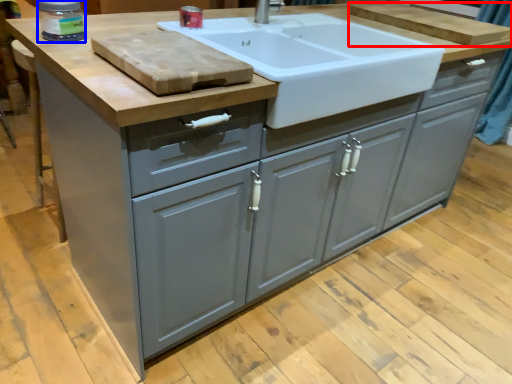
Question: Which object is closer to the camera taking this photo, cutting board (highlighted by a red box) or appliance (highlighted by a blue box)?

Choices:
 (A) cutting board
 (B) appliance

Answer: (B)